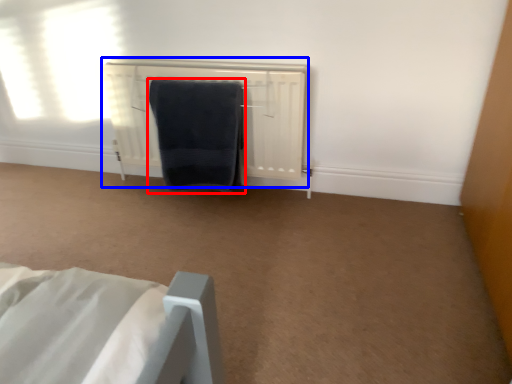
Question: Which point is further to the camera, towel (highlighted by a red box) or radiator (highlighted by a blue box)?

Choices:
 (A) towel
 (B) radiator

Answer: (B)